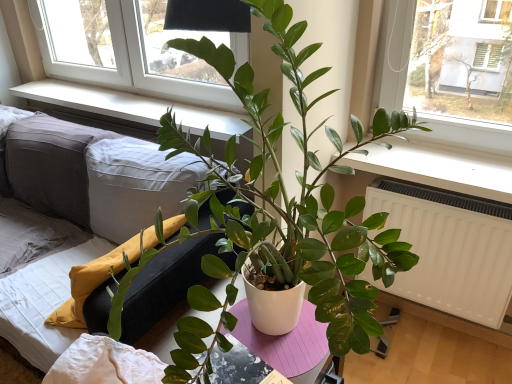
Question: Considering the relative positions of white smooth window sill at upper center and gray fabric couch at center in the image provided, is white smooth window sill at upper center to the left or to the right of gray fabric couch at center?

Choices:
 (A) left
 (B) right

Answer: (B)

Question: Is point (69, 96) closer or farther from the camera than point (12, 266)?

Choices:
 (A) farther
 (B) closer

Answer: (A)

Question: Estimate the real-world distances between objects in this image. Which object is closer to the gray fabric couch at center?

Choices:
 (A) white matte pot at center
 (B) white smooth window sill at upper center
 (C) white matte radiator at lower right

Answer: (B)

Question: Estimate the real-world distances between objects in this image. Which object is farther from the gray fabric couch at center?

Choices:
 (A) white smooth window sill at upper center
 (B) white matte radiator at lower right
 (C) white matte pot at center

Answer: (B)